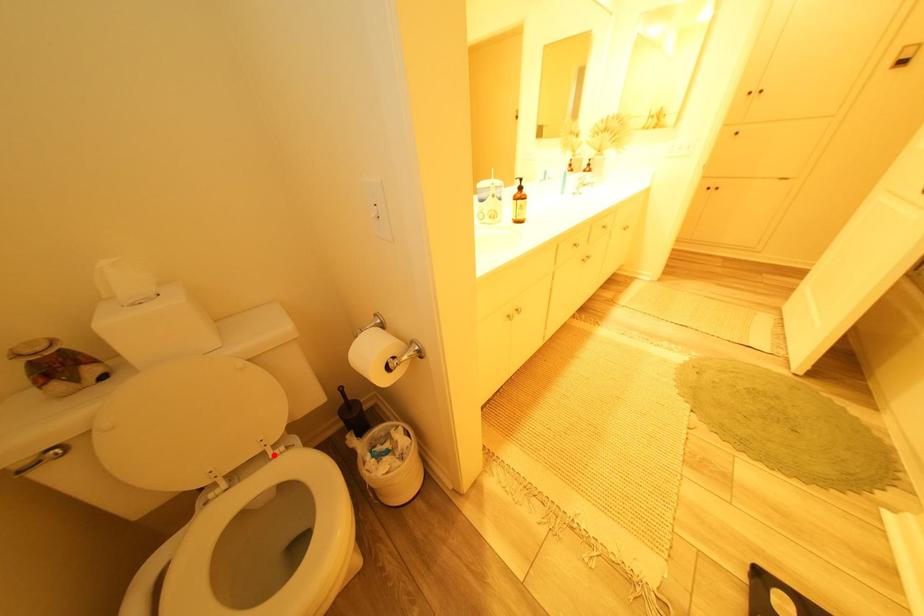
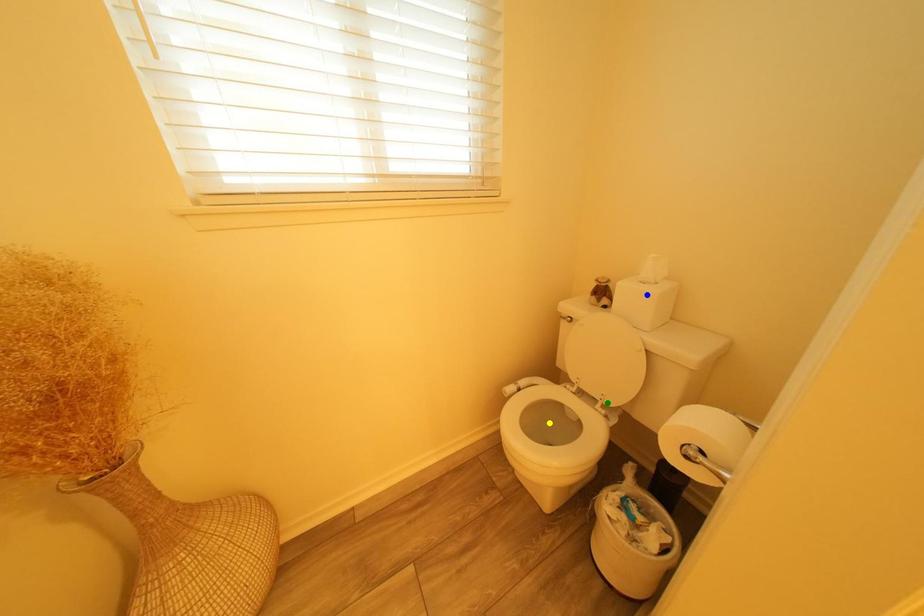
Question: I am providing you with two images of the same scene from different viewpoints. A red point is marked on the first image. You are given multiple points on the second image. Which point in image 2 represents the same 3d spot as the red point in image 1?

Choices:
 (A) green point
 (B) blue point
 (C) yellow point

Answer: (A)